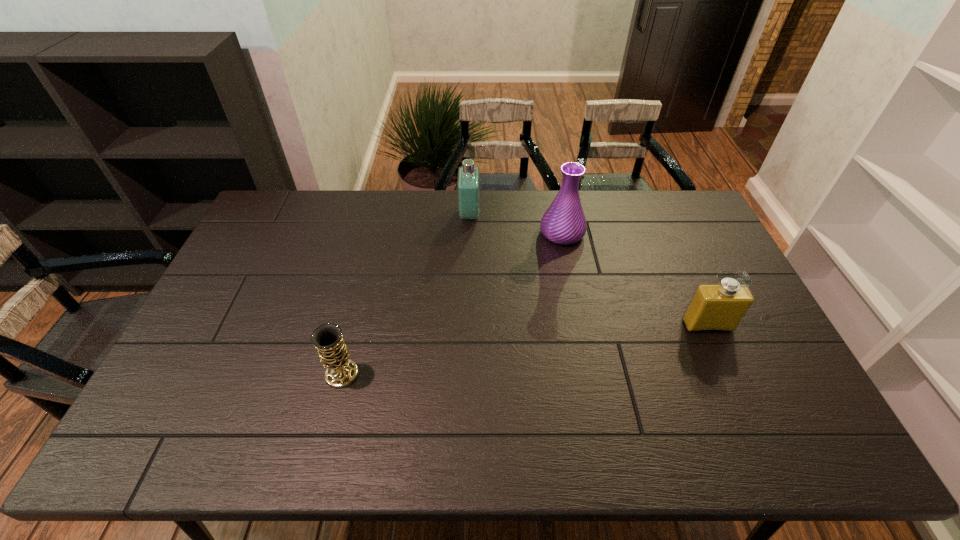
Where is `free space located on the front-facing side of the rightmost object`? free space located on the front-facing side of the rightmost object is located at coordinates (742, 402).

Where is `free point located on the front of the chalice`? free point located on the front of the chalice is located at coordinates (322, 456).

Find the location of `vase at the far edge`. vase at the far edge is located at coordinates (564, 222).

Find the location of `perfume present at the far edge`. perfume present at the far edge is located at coordinates (468, 183).

Find the location of a particular element. This screenshot has height=540, width=960. object present at the right edge is located at coordinates (721, 307).

In the image, there is a desktop. At what (x,y) coordinates should I click in order to perform the action: click on free region at the far edge. Please return your answer as a coordinate pair (x, y). The height and width of the screenshot is (540, 960). Looking at the image, I should click on (610, 194).

The image size is (960, 540). Find the location of `vacant space at the near edge of the desktop`. vacant space at the near edge of the desktop is located at coordinates (419, 436).

In the image, there is a desktop. At what (x,y) coordinates should I click in order to perform the action: click on free region at the far right corner. Please return your answer as a coordinate pair (x, y). Image resolution: width=960 pixels, height=540 pixels. Looking at the image, I should click on (684, 230).

The height and width of the screenshot is (540, 960). I want to click on free space at the near right corner, so [x=811, y=441].

The height and width of the screenshot is (540, 960). I want to click on unoccupied area between the vase and the leftmost object, so click(x=452, y=303).